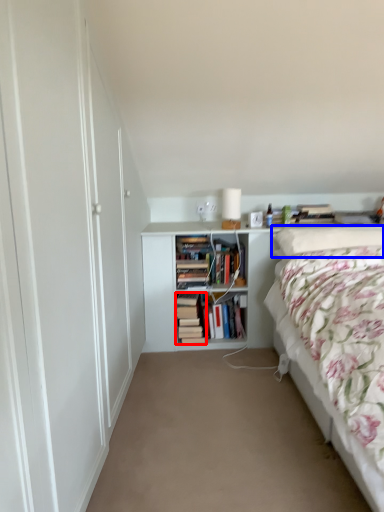
Question: Which of the following is the closest to the observer, book (highlighted by a red box) or pillow (highlighted by a blue box)?

Choices:
 (A) book
 (B) pillow

Answer: (B)